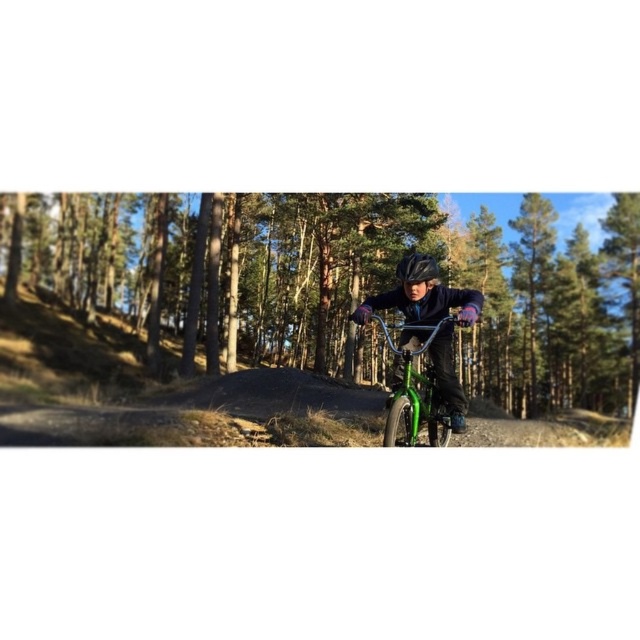
Question: Does green metallic bicycle at center appear over green matte mountain bike at center?

Choices:
 (A) yes
 (B) no

Answer: (A)

Question: Which object appears farthest from the camera in this image?

Choices:
 (A) green metallic bicycle at center
 (B) green matte mountain bike at center

Answer: (A)

Question: Which point appears closest to the camera in this image?

Choices:
 (A) (440, 440)
 (B) (250, 332)

Answer: (A)

Question: Is green metallic bicycle at center wider than green matte mountain bike at center?

Choices:
 (A) yes
 (B) no

Answer: (A)

Question: From the image, what is the correct spatial relationship of green metallic bicycle at center in relation to green matte mountain bike at center?

Choices:
 (A) left
 (B) right

Answer: (B)

Question: Which object appears farthest from the camera in this image?

Choices:
 (A) green matte mountain bike at center
 (B) green metallic bicycle at center

Answer: (B)